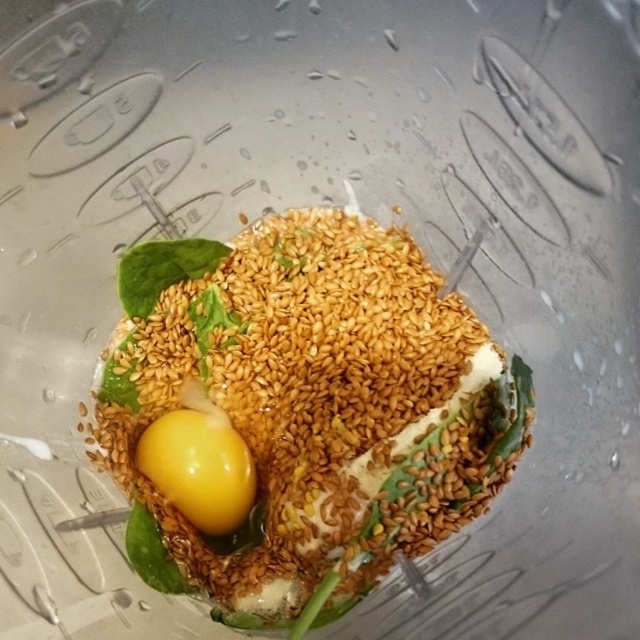
Question: Can you confirm if yellow egg yolk at center is thinner than yellow smooth egg at center?

Choices:
 (A) no
 (B) yes

Answer: (A)

Question: Does yellow egg yolk at center have a lesser width compared to yellow smooth egg at center?

Choices:
 (A) no
 (B) yes

Answer: (A)

Question: Can you confirm if yellow egg yolk at center is positioned below yellow smooth egg at center?

Choices:
 (A) yes
 (B) no

Answer: (B)